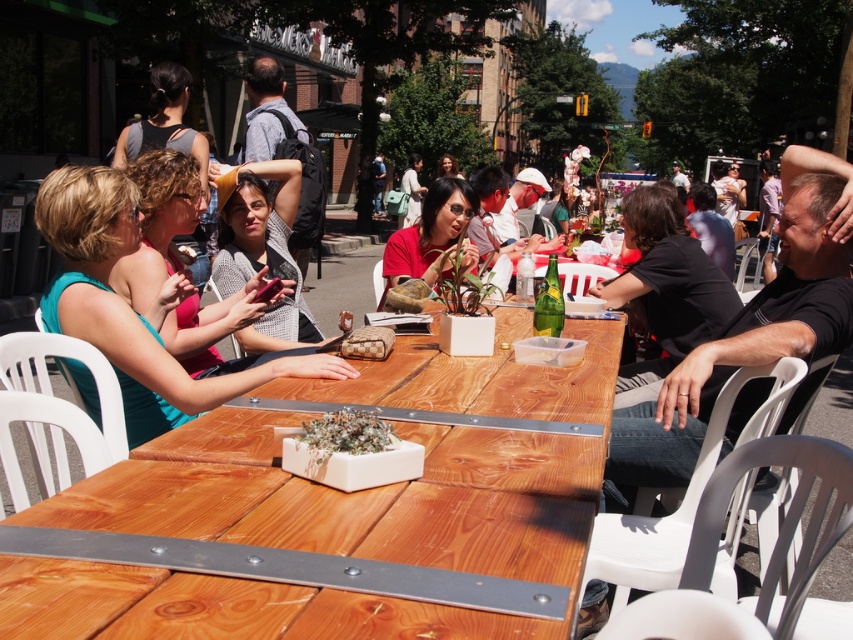
You are a photographer setting up a shoot at this outdoor dining area. You need to position a light source so it can illuminate both the matte teal dress at left and the matte red shirt at center. Considering their heights, which object should the light be angled towards first to ensure both are well lit?

The matte teal dress at left is taller than the matte red shirt at center, so the light should be angled towards the matte teal dress at left first to ensure proper illumination for both.

You are a customer at the outdoor dining area and you want to know which shirt is wider between the black matte shirt at upper right and the matte red shirt at center. Can you tell me?

The black matte shirt at upper right is wider than the matte red shirt at center since its width surpasses the latter.